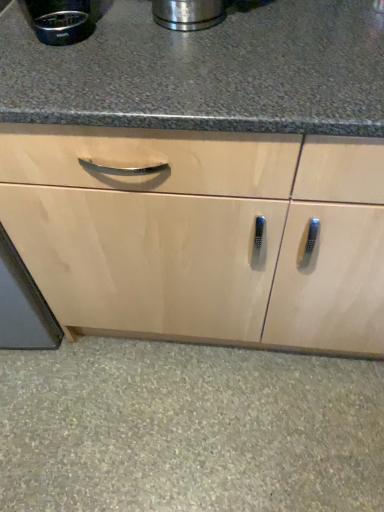
This screenshot has width=384, height=512. Identify the location of natural stone floor at lower center. (188, 429).

What is the approximate height of natural stone floor at lower center?

1.31 inches.

Measure the distance between natural stone floor at lower center and camera.

natural stone floor at lower center is 1.08 meters from camera.

What do you see at coordinates (188, 429) in the screenshot? The image size is (384, 512). I see `natural stone floor at lower center` at bounding box center [188, 429].

Measure the distance between brushed metal coffee maker at upper left and camera.

brushed metal coffee maker at upper left and camera are 31.09 inches apart.

What do you see at coordinates (64, 19) in the screenshot? The width and height of the screenshot is (384, 512). I see `brushed metal coffee maker at upper left` at bounding box center [64, 19].

The image size is (384, 512). What are the coordinates of `brushed metal coffee maker at upper left` in the screenshot? It's located at (64, 19).

The image size is (384, 512). I want to click on natural stone floor at lower center, so tap(188, 429).

Between natural stone floor at lower center and brushed metal coffee maker at upper left, which one appears on the left side from the viewer's perspective?

brushed metal coffee maker at upper left.

Considering the positions of objects natural stone floor at lower center and brushed metal coffee maker at upper left in the image provided, who is behind, natural stone floor at lower center or brushed metal coffee maker at upper left?

natural stone floor at lower center is behind.

Does point (348, 447) come closer to viewer compared to point (79, 8)?

No, it is behind (79, 8).

From the image's perspective, is natural stone floor at lower center positioned above or below brushed metal coffee maker at upper left?

natural stone floor at lower center is situated lower than brushed metal coffee maker at upper left in the image.

From a real-world perspective, which is physically above, natural stone floor at lower center or brushed metal coffee maker at upper left?

In real-world perspective, brushed metal coffee maker at upper left is above.

Which of these two, natural stone floor at lower center or brushed metal coffee maker at upper left, is thinner?

brushed metal coffee maker at upper left is thinner.

Considering the sizes of natural stone floor at lower center and brushed metal coffee maker at upper left in the image, is natural stone floor at lower center taller or shorter than brushed metal coffee maker at upper left?

Clearly, natural stone floor at lower center is shorter compared to brushed metal coffee maker at upper left.

Can you confirm if natural stone floor at lower center is smaller than brushed metal coffee maker at upper left?

No, natural stone floor at lower center is not smaller than brushed metal coffee maker at upper left.

Would you say natural stone floor at lower center contains brushed metal coffee maker at upper left?

No, brushed metal coffee maker at upper left is not surrounded by natural stone floor at lower center.

Would you say natural stone floor at lower center is a long distance from brushed metal coffee maker at upper left?

Absolutely, natural stone floor at lower center is distant from brushed metal coffee maker at upper left.

Is brushed metal coffee maker at upper left at the back of natural stone floor at lower center?

No.

How distant is natural stone floor at lower center from brushed metal coffee maker at upper left?

The distance of natural stone floor at lower center from brushed metal coffee maker at upper left is 1.05 meters.

The height and width of the screenshot is (512, 384). I want to click on granite located on the right of brushed metal coffee maker at upper left, so click(188, 429).

Which object is positioned more to the right, brushed metal coffee maker at upper left or natural stone floor at lower center?

From the viewer's perspective, natural stone floor at lower center appears more on the right side.

Which object is closer to the camera taking this photo, brushed metal coffee maker at upper left or natural stone floor at lower center?

brushed metal coffee maker at upper left is more forward.

Which is behind, point (57, 42) or point (26, 420)?

The point (26, 420) is more distant.

From the image's perspective, is brushed metal coffee maker at upper left under natural stone floor at lower center?

Incorrect, from the image's perspective, brushed metal coffee maker at upper left is higher than natural stone floor at lower center.

From a real-world perspective, which object rests below the other?

In real-world perspective, natural stone floor at lower center is lower.

In terms of width, does brushed metal coffee maker at upper left look wider or thinner when compared to natural stone floor at lower center?

In the image, brushed metal coffee maker at upper left appears to be more narrow than natural stone floor at lower center.

In the scene shown: Is brushed metal coffee maker at upper left shorter than natural stone floor at lower center?

Incorrect, the height of brushed metal coffee maker at upper left does not fall short of that of natural stone floor at lower center.

Who is smaller, brushed metal coffee maker at upper left or natural stone floor at lower center?

With smaller size is brushed metal coffee maker at upper left.

Is natural stone floor at lower center a part of brushed metal coffee maker at upper left?

No.

In the scene shown: Is brushed metal coffee maker at upper left touching natural stone floor at lower center?

No.

From the picture: Is brushed metal coffee maker at upper left oriented towards natural stone floor at lower center?

No, brushed metal coffee maker at upper left is not aimed at natural stone floor at lower center.

Could you measure the distance between brushed metal coffee maker at upper left and natural stone floor at lower center?

brushed metal coffee maker at upper left and natural stone floor at lower center are 1.05 meters apart.

Where is `granite below the brushed metal coffee maker at upper left (from a real-world perspective)`? granite below the brushed metal coffee maker at upper left (from a real-world perspective) is located at coordinates (188, 429).

Identify the location of appliance above the natural stone floor at lower center (from the image's perspective). This screenshot has width=384, height=512. (64, 19).

This screenshot has width=384, height=512. I want to click on appliance located on the left of natural stone floor at lower center, so click(x=64, y=19).